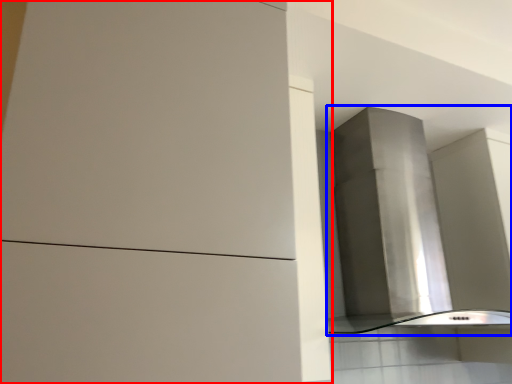
Question: Among these objects, which one is farthest to the camera, cabinetry (highlighted by a red box) or vent (highlighted by a blue box)?

Choices:
 (A) cabinetry
 (B) vent

Answer: (B)